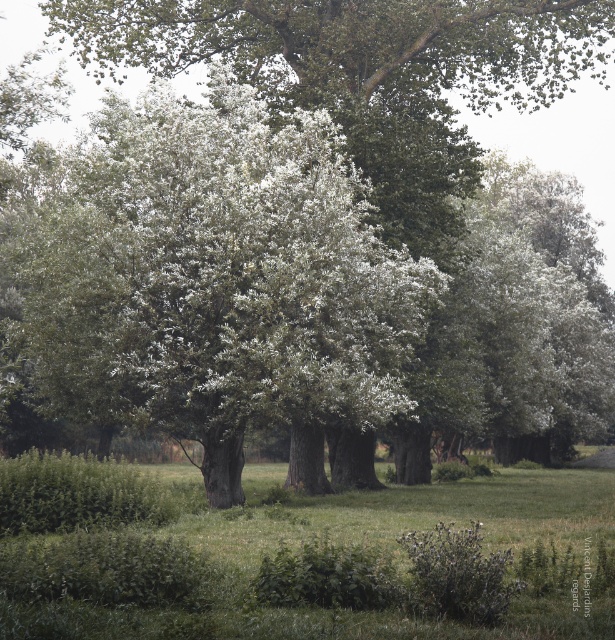
You are a gardener planning to trim both the green matte tree at center and the green leafy hedge at lower left. Which object should you prioritize if you need to work on the taller one first?

The green matte tree at center is taller than the green leafy hedge at lower left, so you should prioritize trimming the green matte tree at center first.

You are standing in the middle of the forest and see the green matte tree at center and the green leafy hedge at lower left. Which object is positioned further to the right from your perspective?

The green leafy hedge at lower left is positioned further to the right compared to the green matte tree at center because the green matte tree at center is to the left of green leafy hedge at lower left.